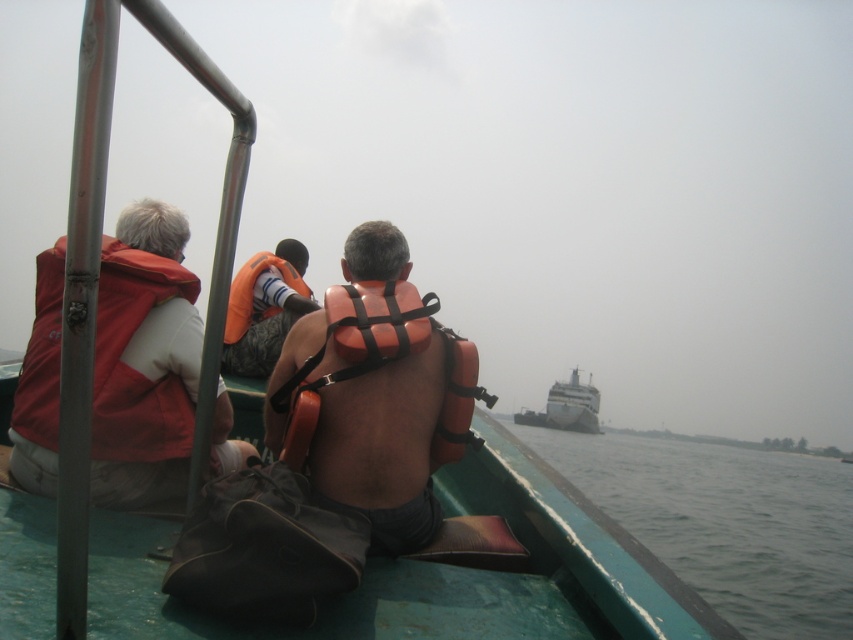
Question: Among these points, which one is nearest to the camera?

Choices:
 (A) (283, 282)
 (B) (520, 413)
 (C) (267, 406)

Answer: (C)

Question: Which point is farther to the camera?

Choices:
 (A) (561, 397)
 (B) (242, 328)
 (C) (387, 310)
 (D) (767, 509)

Answer: (A)

Question: Which of these objects is positioned farthest from the white glossy cruise ship at center?

Choices:
 (A) matte orange life jacket at left
 (B) orange life jacket at center

Answer: (A)

Question: Does matte orange life vest at center appear on the left side of matte orange life jacket at left?

Choices:
 (A) yes
 (B) no

Answer: (A)

Question: Can you confirm if matte orange life jacket at left is bigger than orange life jacket at center?

Choices:
 (A) no
 (B) yes

Answer: (B)

Question: Does matte orange life vest at center have a smaller size compared to orange life jacket at center?

Choices:
 (A) yes
 (B) no

Answer: (B)